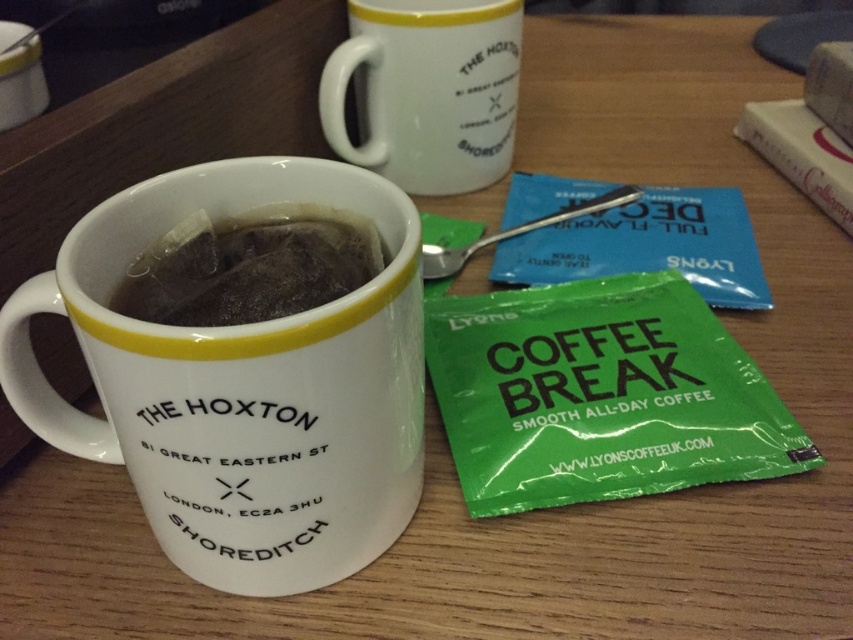
Question: Can you confirm if white glossy mug at center is positioned below white glossy mug at upper center?

Choices:
 (A) no
 (B) yes

Answer: (B)

Question: Which object appears closest to the camera in this image?

Choices:
 (A) white glossy mug at center
 (B) white glossy mug at upper center
 (C) black paper tea bag at center

Answer: (A)

Question: Does white glossy mug at upper center come in front of black paper tea bag at center?

Choices:
 (A) yes
 (B) no

Answer: (B)

Question: Which object appears closest to the camera in this image?

Choices:
 (A) white glossy mug at center
 (B) white glossy mug at upper center
 (C) black paper tea bag at center

Answer: (A)

Question: Which of these objects is positioned farthest from the black paper tea bag at center?

Choices:
 (A) white glossy mug at upper center
 (B) white glossy mug at center

Answer: (A)

Question: Is white glossy mug at center thinner than white glossy mug at upper center?

Choices:
 (A) no
 (B) yes

Answer: (A)